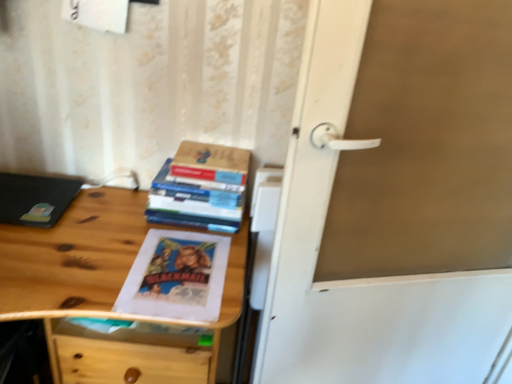
Question: Considering the positions of hardcover book at upper center and matte black laptop at left in the image, is hardcover book at upper center wider or thinner than matte black laptop at left?

Choices:
 (A) thin
 (B) wide

Answer: (A)

Question: From a real-world perspective, is hardcover book at upper center positioned above or below matte black laptop at left?

Choices:
 (A) below
 (B) above

Answer: (B)

Question: Estimate the real-world distances between objects in this image. Which object is farther from the hardcover book at upper center?

Choices:
 (A) white matte door handle at center
 (B) wooden desk at left
 (C) hardcover books at center
 (D) matte black laptop at left

Answer: (A)

Question: Which object is the farthest from the hardcover books at center?

Choices:
 (A) wooden desk at left
 (B) hardcover book at upper center
 (C) white matte door handle at center
 (D) matte black laptop at left

Answer: (C)